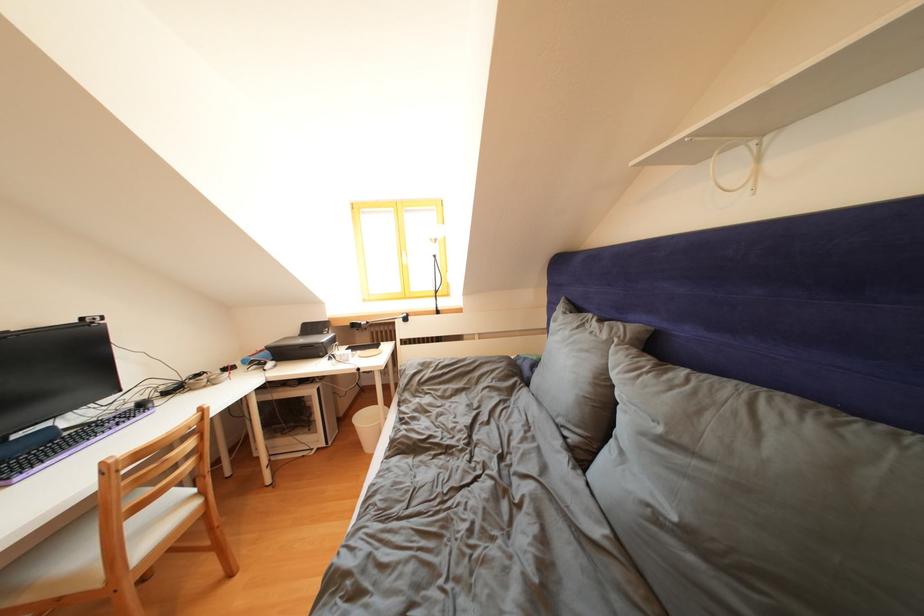
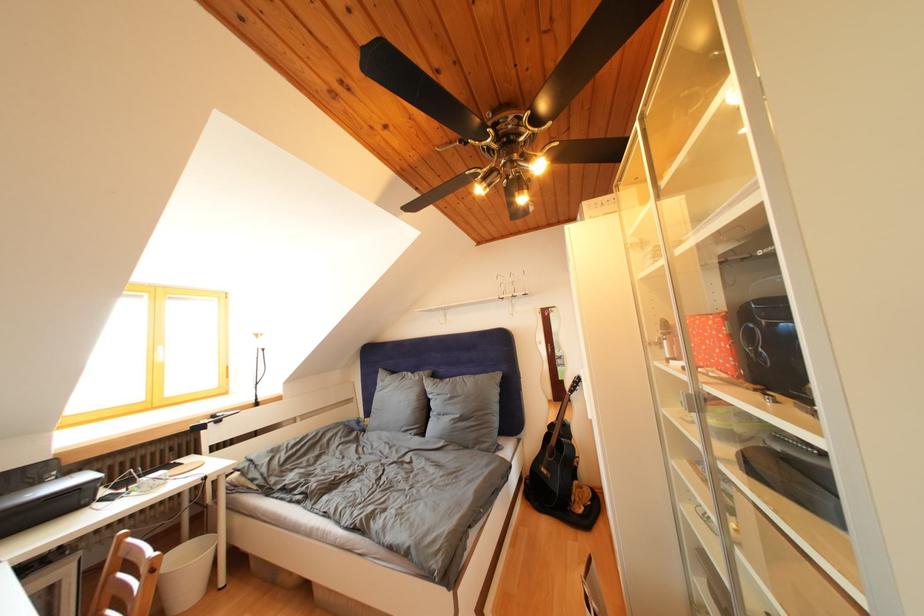
The point at (x=438, y=310) is marked in the first image. Where is the corresponding point in the second image?

(257, 403)